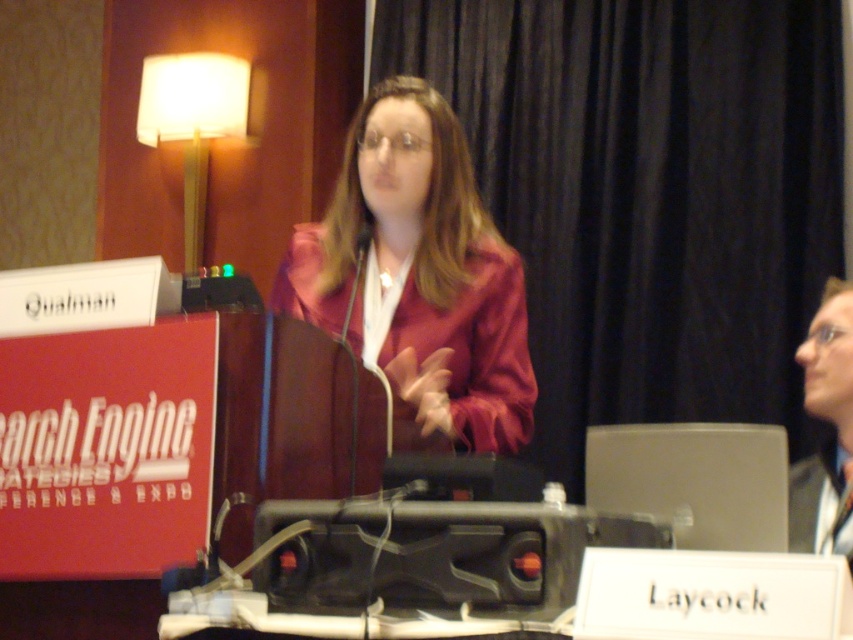
Where is `satin red jacket at center`? The width and height of the screenshot is (853, 640). satin red jacket at center is located at coordinates (419, 275).

Which is in front, point (340, 196) or point (833, 400)?

Point (833, 400) is in front.

Can you confirm if satin red jacket at center is wider than matte black laptop at upper right?

Yes.

You are a GUI agent. You are given a task and a screenshot of the screen. Output one action in this format:
    pyautogui.click(x=<x>, y=<y>)
    Task: Click on the satin red jacket at center
    Image resolution: width=853 pixels, height=640 pixels.
    Given the screenshot: What is the action you would take?
    pyautogui.click(x=419, y=275)

This screenshot has width=853, height=640. I want to click on satin red jacket at center, so click(419, 275).

Does satin silver laptop at center have a lesser width compared to white fabric lampshade at upper left?

Correct, satin silver laptop at center's width is less than white fabric lampshade at upper left's.

Between point (781, 428) and point (144, 124), which one is positioned behind?

The point (144, 124) is more distant.

Locate an element on the screen. satin silver laptop at center is located at coordinates (694, 481).